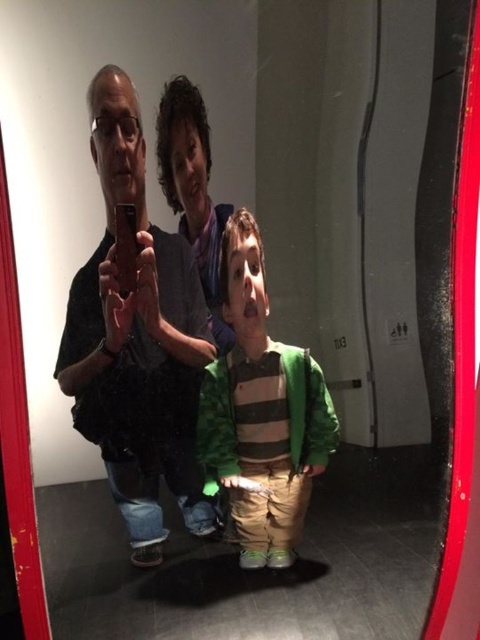
Which is below, matte black shirt at left or green striped sweater at center?

Positioned lower is green striped sweater at center.

Does matte black shirt at left appear on the right side of green striped sweater at center?

In fact, matte black shirt at left is to the left of green striped sweater at center.

Which is behind, point (87, 93) or point (256, 424)?

Point (256, 424)

Locate an element on the screen. This screenshot has width=480, height=640. matte black shirt at left is located at coordinates (136, 340).